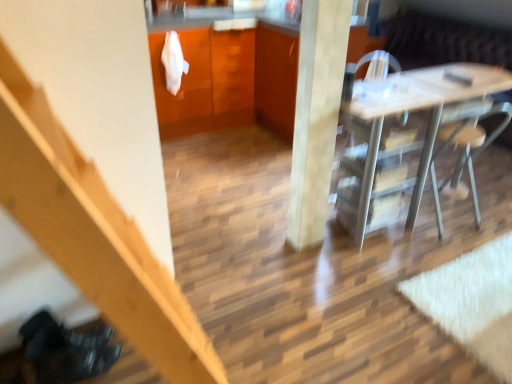
Question: Does smooth light wood pillar at center have a smaller size compared to metallic silver chair at right?

Choices:
 (A) yes
 (B) no

Answer: (A)

Question: From a real-world perspective, is smooth light wood pillar at center on metallic silver chair at right?

Choices:
 (A) no
 (B) yes

Answer: (B)

Question: Considering the relative sizes of smooth light wood pillar at center and metallic silver chair at right in the image provided, is smooth light wood pillar at center thinner than metallic silver chair at right?

Choices:
 (A) no
 (B) yes

Answer: (B)

Question: Is smooth light wood pillar at center to the right of metallic silver chair at right from the viewer's perspective?

Choices:
 (A) no
 (B) yes

Answer: (A)

Question: Can you confirm if smooth light wood pillar at center is positioned to the left of metallic silver chair at right?

Choices:
 (A) no
 (B) yes

Answer: (B)

Question: Can you confirm if smooth light wood pillar at center is bigger than metallic silver chair at right?

Choices:
 (A) no
 (B) yes

Answer: (A)

Question: Is white glossy desk at center smaller than matte wood dresser at upper center?

Choices:
 (A) yes
 (B) no

Answer: (A)

Question: Considering the relative sizes of white glossy desk at center and matte wood dresser at upper center in the image provided, is white glossy desk at center taller than matte wood dresser at upper center?

Choices:
 (A) no
 (B) yes

Answer: (A)

Question: Is white glossy desk at center at the right side of matte wood dresser at upper center?

Choices:
 (A) yes
 (B) no

Answer: (A)

Question: Is white glossy desk at center positioned behind matte wood dresser at upper center?

Choices:
 (A) yes
 (B) no

Answer: (B)

Question: Does white glossy desk at center touch matte wood dresser at upper center?

Choices:
 (A) no
 (B) yes

Answer: (A)

Question: From the image's perspective, is white glossy desk at center above matte wood dresser at upper center?

Choices:
 (A) no
 (B) yes

Answer: (A)

Question: Is wooden stairs at left completely or partially inside smooth light wood pillar at center?

Choices:
 (A) no
 (B) yes

Answer: (A)